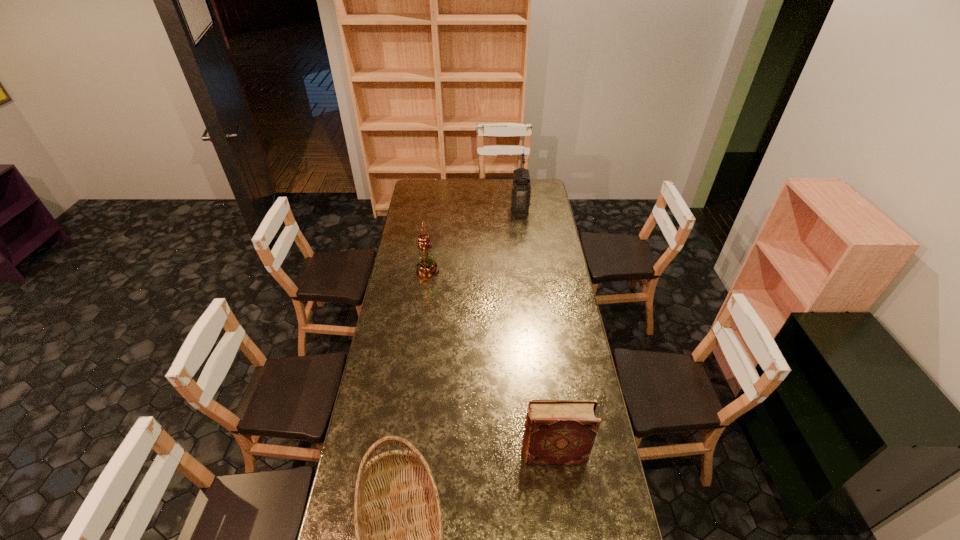
What are the coordinates of `vacant point located between the lantern and the hardback book` in the screenshot? It's located at (537, 331).

I want to click on vacant area between the hardback book and the lantern, so click(537, 331).

Point out which object is positioned as the second nearest to the hardback book. Please provide its 2D coordinates. Your answer should be formatted as a tuple, i.e. [(x, y)], where the tuple contains the x and y coordinates of a point satisfying the conditions above.

[(427, 268)]

You are a GUI agent. You are given a task and a screenshot of the screen. Output one action in this format:
    pyautogui.click(x=<x>, y=<y>)
    Task: Click on the object that is the third closest one to the basket
    
    Given the screenshot: What is the action you would take?
    click(520, 187)

Where is `vacant space that satisfies the following two spatial constraints: 1. on the front-facing side of the lantern; 2. on the front side of the second farthest object`? vacant space that satisfies the following two spatial constraints: 1. on the front-facing side of the lantern; 2. on the front side of the second farthest object is located at coordinates (528, 272).

At what (x,y) coordinates should I click in order to perform the action: click on free space that satisfies the following two spatial constraints: 1. on the front-facing side of the farthest object; 2. on the front side of the third nearest object. Please return your answer as a coordinate pair (x, y). Looking at the image, I should click on (528, 272).